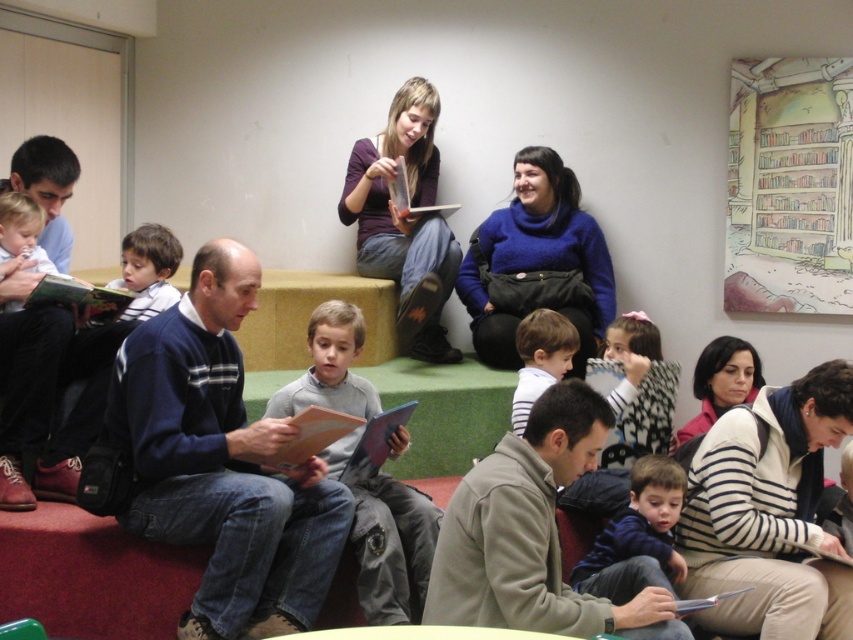
You are standing at the entrance of the library and see the matte blue sweater at left and the white striped shirt at center. Which person is closer to you?

The matte blue sweater at left is closer to you because it is in front of the white striped shirt at center.

You are standing in the library scene and see the point at coordinates (x=27, y=394). What object is located at that point?

The point at coordinates (x=27, y=394) corresponds to the matte blue sweater at left.

You are standing in the library and see two points marked in the scene. Which point is closer to you, point (413,224) or point (83,435)?

Point (83,435) is closer to you because it is positioned closer to the camera than point (413,224).